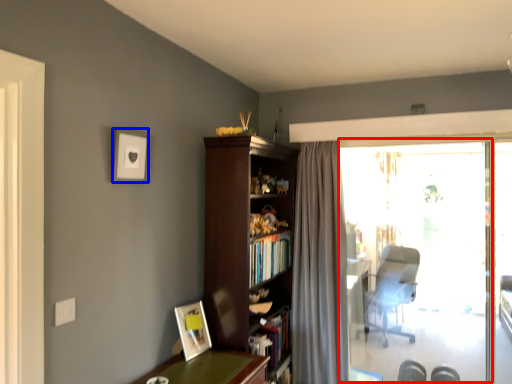
Question: Which point is closer to the camera, window screen (highlighted by a red box) or picture frame (highlighted by a blue box)?

Choices:
 (A) window screen
 (B) picture frame

Answer: (B)